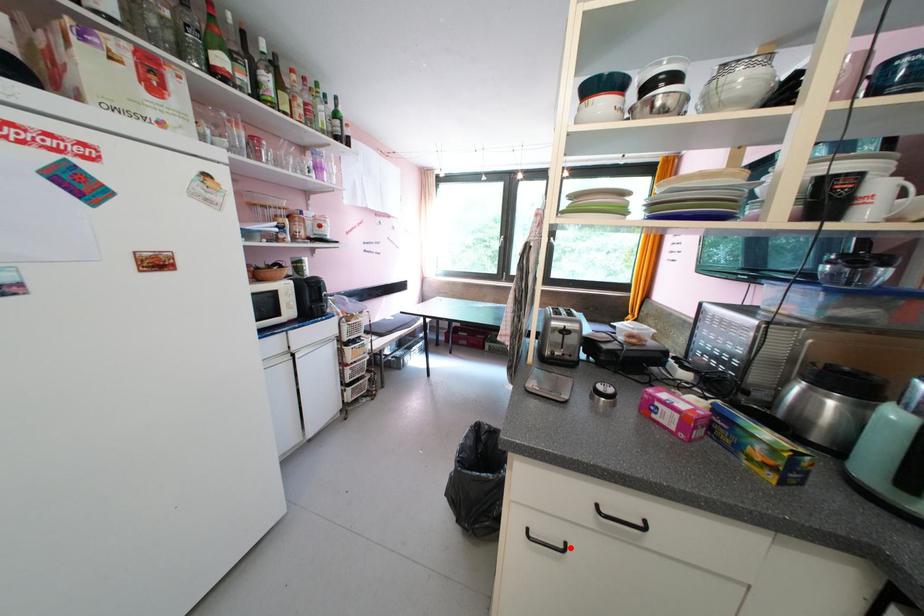
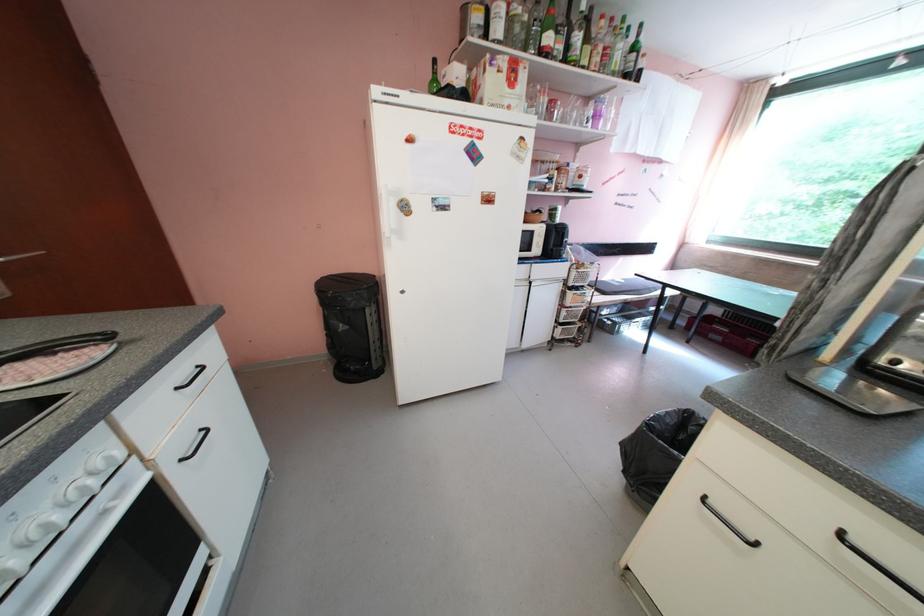
The point at the highlighted location is marked in the first image. Where is the corresponding point in the second image?

(759, 541)